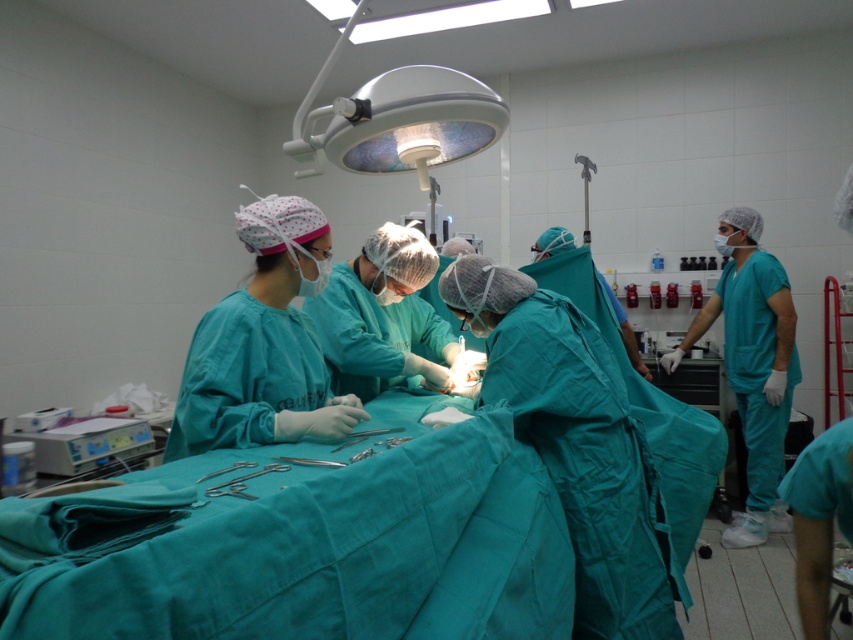
You are a medical student observing a surgery. You notice the teal matte scrubs at right and the metallic silver scissors at center. Which object is higher in the image?

The teal matte scrubs at right is taller than the metallic silver scissors at center, so the teal matte scrubs at right is higher in the image.

You are a surgical nurse standing at the entrance of the operating room. You need to retrieve an instrument from the teal matte scrubs at right and then hand it to the surgeon wearing the matte green gown at center. Considering the distance between them, can you do this without moving more than 2 meters from your starting position?

The teal matte scrubs at right is 1.83 meters away from the matte green gown at center. Since the distance is less than 2 meters, you can retrieve the instrument and hand it over without exceeding the 2 meter limit.

You are a surgical nurse preparing to sterilize the teal matte scrubs at right and the metallic silver scissors at center. The sterilization room is 10 feet away from the current location. Can you carry both items to the sterilization room without exceeding the distance limit?

The teal matte scrubs at right is 9.02 feet from metallic silver scissors at center. Since the sterilization room is 10 feet away, you can carry both items as the total distance from the scrubs to the scissors and then to the sterilization room would be within the 10 feet limit.